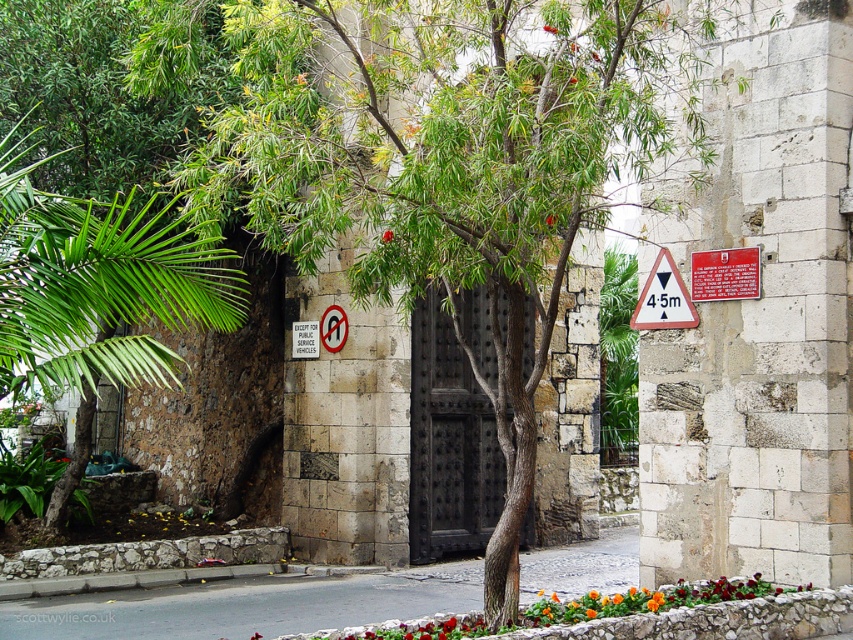
Question: Does gray concrete pavement at center lie behind white paper sign at center?

Choices:
 (A) yes
 (B) no

Answer: (B)

Question: Which point is farther to the camera?

Choices:
 (A) orange matte flower bed at lower center
 (B) white paper sign at center

Answer: (B)

Question: Which point is closer to the camera?

Choices:
 (A) gray concrete pavement at center
 (B) white paper sign at center
 (C) black wrought iron door at center
 (D) green leafy tree at center

Answer: (D)

Question: Is green leafy tree at left in front of black wrought iron door at center?

Choices:
 (A) yes
 (B) no

Answer: (A)

Question: Which object appears closest to the camera in this image?

Choices:
 (A) green leafy tree at center
 (B) black wrought iron door at center

Answer: (A)

Question: Can you confirm if green leafy tree at center is positioned above red matte flower at center?

Choices:
 (A) yes
 (B) no

Answer: (A)